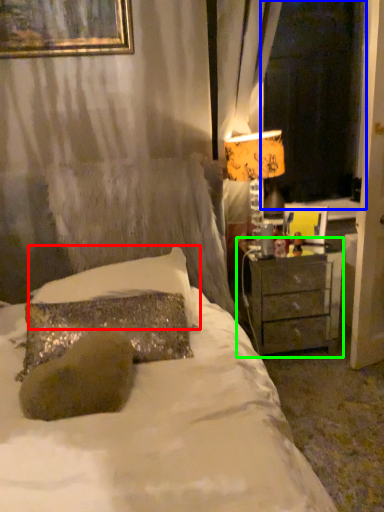
Question: Based on their relative distances, which object is farther from pillow (highlighted by a red box)? Choose from window screen (highlighted by a blue box) and nightstand (highlighted by a green box).

Choices:
 (A) window screen
 (B) nightstand

Answer: (A)